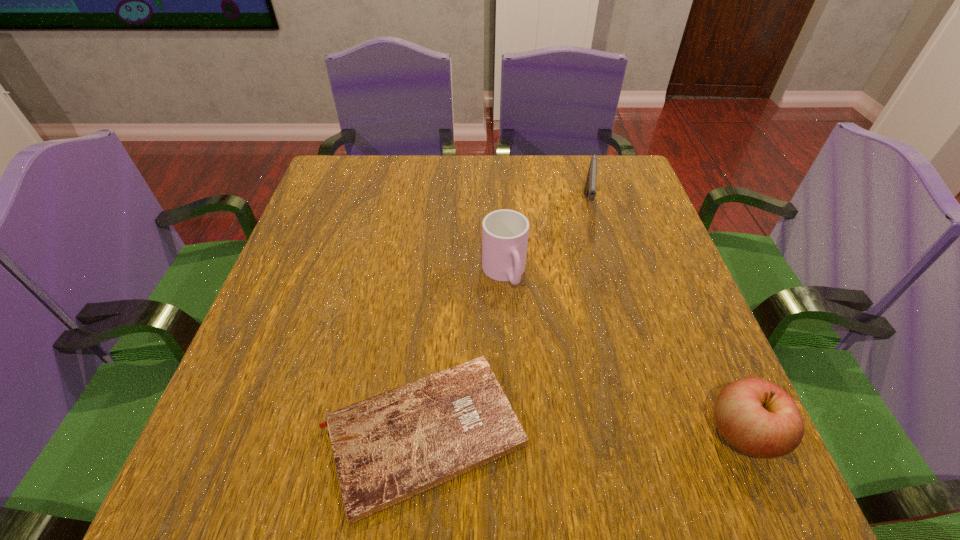
Locate an element on the screen. vacant position located at the barrel of the third object from left to right is located at coordinates (588, 295).

At what (x,y) coordinates should I click in order to perform the action: click on vacant space situated 0.140m at the barrel of the third object from left to right. Please return your answer as a coordinate pair (x, y). The width and height of the screenshot is (960, 540). Looking at the image, I should click on (588, 266).

Where is `free region located at the barrel of the third object from left to right`? The height and width of the screenshot is (540, 960). free region located at the barrel of the third object from left to right is located at coordinates (586, 317).

Identify the location of object that is at the far edge. (590, 186).

This screenshot has height=540, width=960. I want to click on Bible at the near edge, so click(x=388, y=448).

The height and width of the screenshot is (540, 960). Identify the location of apple that is positioned at the near edge. click(x=757, y=417).

At what (x,y) coordinates should I click in order to perform the action: click on apple located in the right edge section of the desktop. Please return your answer as a coordinate pair (x, y). This screenshot has width=960, height=540. Looking at the image, I should click on (757, 417).

The image size is (960, 540). I want to click on pistol present at the right edge, so click(590, 186).

Where is `object that is positioned at the far right corner`? object that is positioned at the far right corner is located at coordinates (590, 186).

Locate an element on the screen. The width and height of the screenshot is (960, 540). object located at the near right corner is located at coordinates (757, 417).